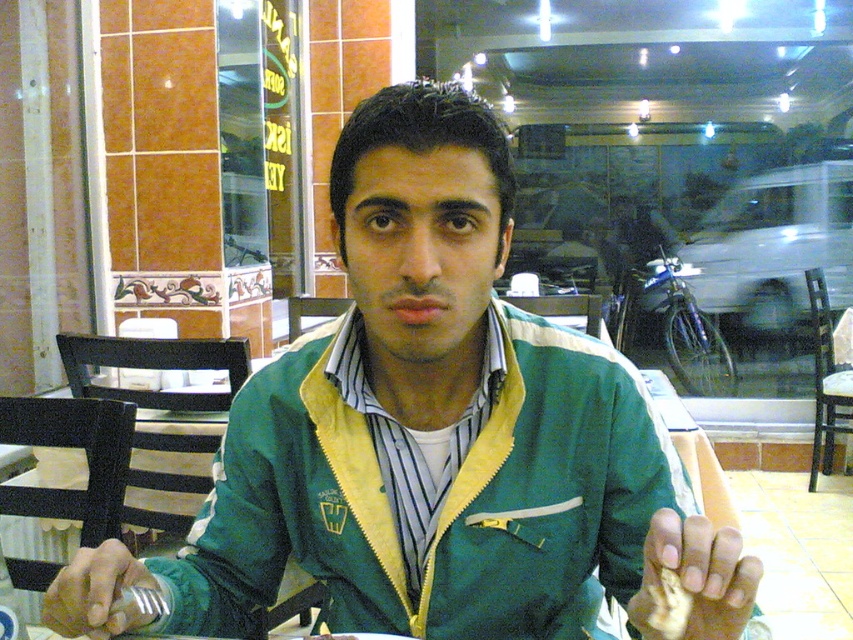
Question: Is green/yellow fabric jacket at center wider than yellowish matte bread at center?

Choices:
 (A) yes
 (B) no

Answer: (A)

Question: Estimate the real-world distances between objects in this image. Which object is farther from the green/yellow fabric jacket at center?

Choices:
 (A) yellowish matte bread at center
 (B) green/yellow jacket at center

Answer: (A)

Question: Considering the relative positions of green/yellow fabric jacket at center and yellowish matte bread at center in the image provided, where is green/yellow fabric jacket at center located with respect to yellowish matte bread at center?

Choices:
 (A) below
 (B) above

Answer: (B)

Question: Which of these objects is positioned closest to the green/yellow jacket at center?

Choices:
 (A) yellowish matte bread at center
 (B) green/yellow fabric jacket at center

Answer: (B)

Question: Which object is farther from the camera taking this photo?

Choices:
 (A) green/yellow fabric jacket at center
 (B) yellowish matte bread at center

Answer: (A)

Question: Considering the relative positions of green/yellow jacket at center and yellowish matte bread at center in the image provided, where is green/yellow jacket at center located with respect to yellowish matte bread at center?

Choices:
 (A) right
 (B) left

Answer: (B)